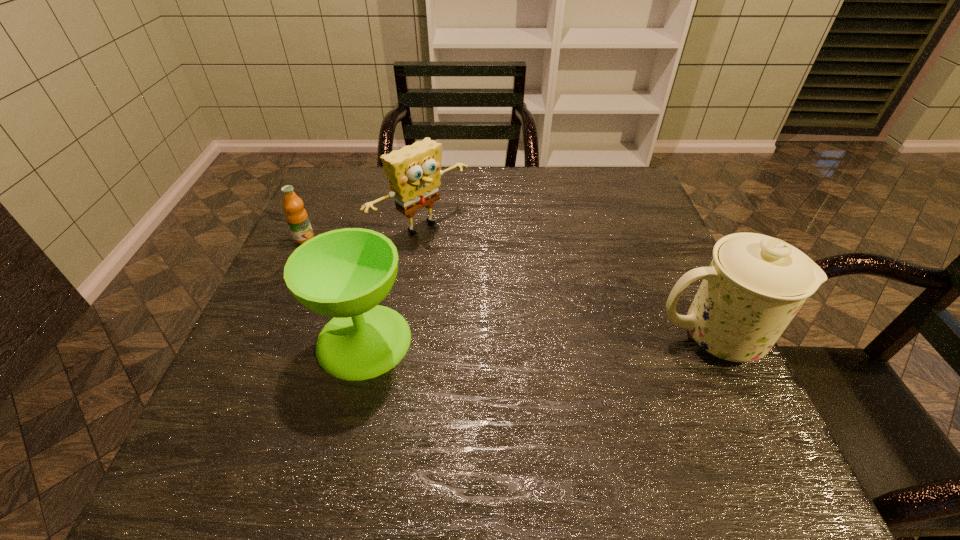
Locate an element on the screen. This screenshot has width=960, height=540. wineglass is located at coordinates (345, 273).

Where is `the rightmost object`? This screenshot has width=960, height=540. the rightmost object is located at coordinates (755, 284).

Locate an element on the screen. the leftmost object is located at coordinates (296, 216).

This screenshot has height=540, width=960. In order to click on the shortest object in this screenshot , I will do `click(296, 216)`.

Identify the location of sponge. This screenshot has height=540, width=960. (414, 172).

Locate an element on the screen. The image size is (960, 540). free space located on the right of the wineglass is located at coordinates (518, 340).

The height and width of the screenshot is (540, 960). Identify the location of free space located on the label of the leftmost object. (423, 296).

What are the coordinates of `free location located on the label of the leftmost object` in the screenshot? It's located at (348, 260).

Locate an element on the screen. The height and width of the screenshot is (540, 960). vacant point located on the label of the leftmost object is located at coordinates (399, 284).

The image size is (960, 540). What are the coordinates of `free space located on the face of the sponge` in the screenshot? It's located at (524, 302).